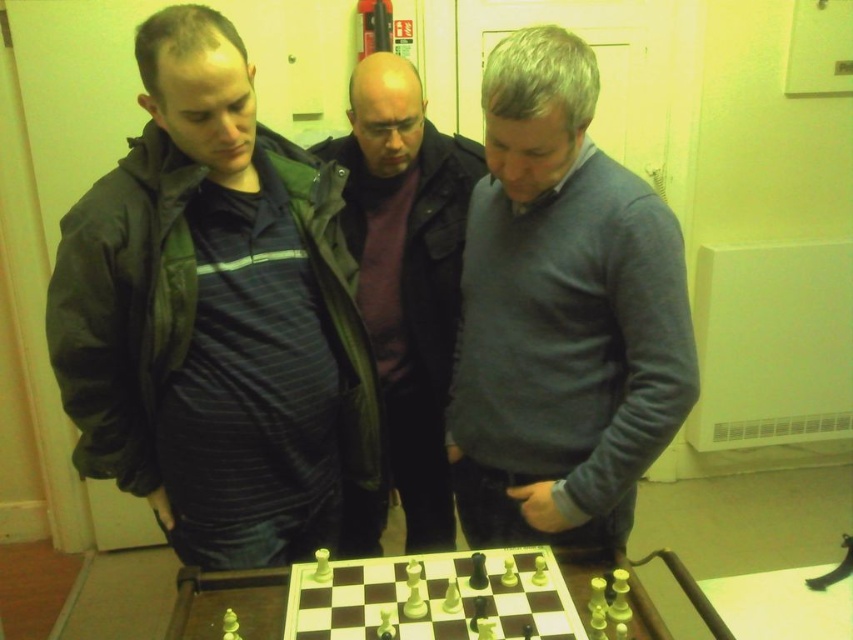
Looking at this image, you are a photographer trying to capture a clear shot of the wooden chessboard at center. However, the dark green jacket at left is blocking your view. Can you move the jacket to get an unobstructed view of the chessboard?

The dark green jacket at left is positioned over the wooden chessboard at center, so moving it would allow an unobstructed view of the chessboard.

You are a photographer in the room and want to take a photo of the dark green jacket at left and the wooden chessboard at center. Since the lighting is dim, you need to ensure both subjects are well lit. Which subject should you adjust the camera focus on first to ensure proper lighting?

The dark green jacket at left is positioned on the left side of wooden chessboard at center, so you should focus on the wooden chessboard at center first since it is the central subject and closer to the main light source.

You are standing in the room where the chess game is happening. There is a point marked at coordinates point [434,417]. Can you reach this point without moving more than 6 feet from your current position?

The point [434,417] is 6.27 feet away from the camera, so you cannot reach it without moving more than 6 feet from your current position.